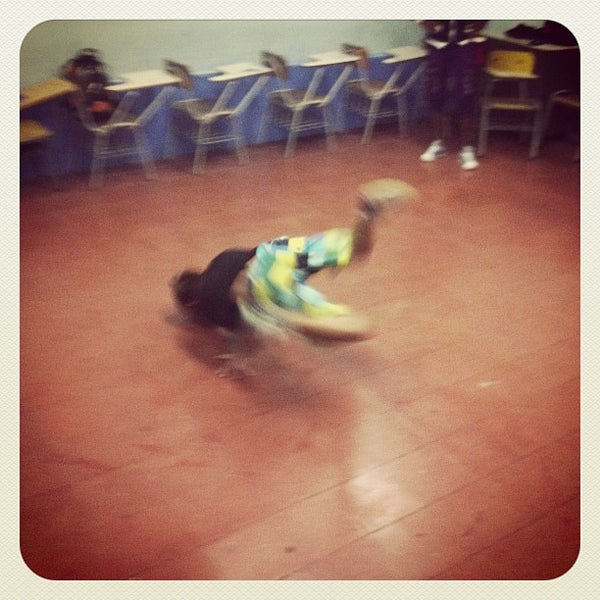
At what (x,y) coordinates should I click in order to perform the action: click on wall. Please return your answer as a coordinate pair (x, y). This screenshot has width=600, height=600. Looking at the image, I should click on (205, 37).